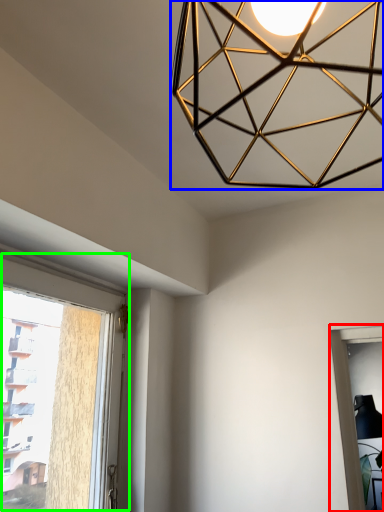
Question: Which object is positioned farthest from window (highlighted by a red box)? Select from lamp (highlighted by a blue box) and window (highlighted by a green box).

Choices:
 (A) lamp
 (B) window

Answer: (B)